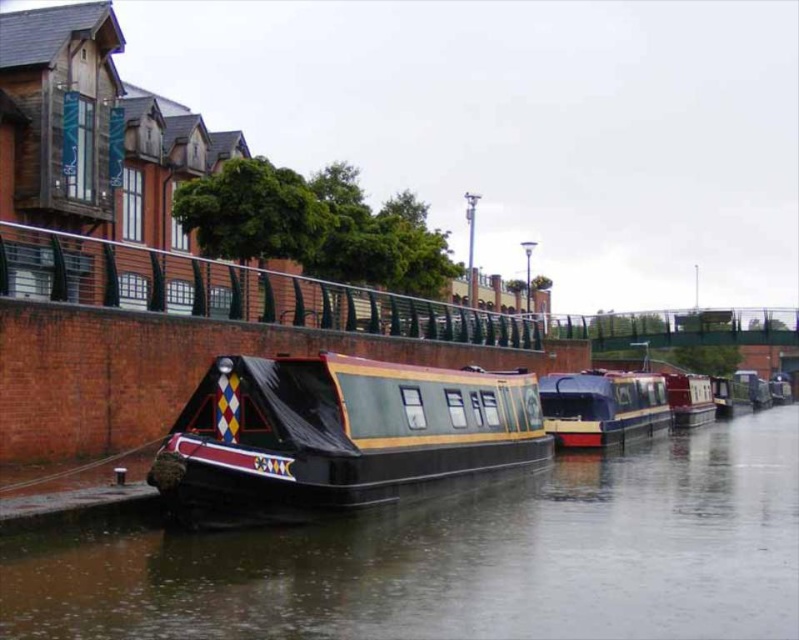
You are standing at the edge of the canal and see a point marked at coordinates (463, 557). Which object from the scene is located at this point?

The point at coordinates (463, 557) corresponds to the black rubber boat at center.

You are standing on the dock and see the black rubber boat at center. If you want to throw a lifebuoy to someone on the boat, and the lifebuoy has a maximum throwing distance of 12 meters, will you be able to reach them?

The distance between you and the black rubber boat at center is 13.05 meters, which exceeds the lifebuoy throwing range of 12 meters. Therefore, you cannot reach them with the lifebuoy.